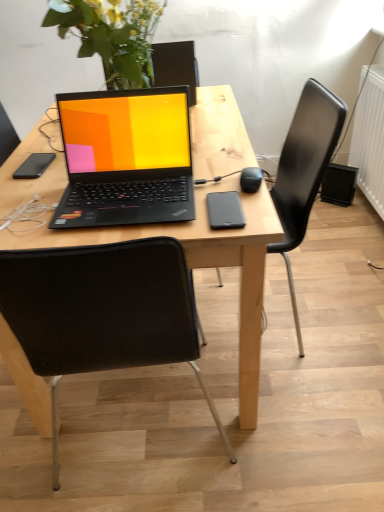
In order to click on vacant space to the right of black matte laptop at center in this screenshot , I will do `click(227, 181)`.